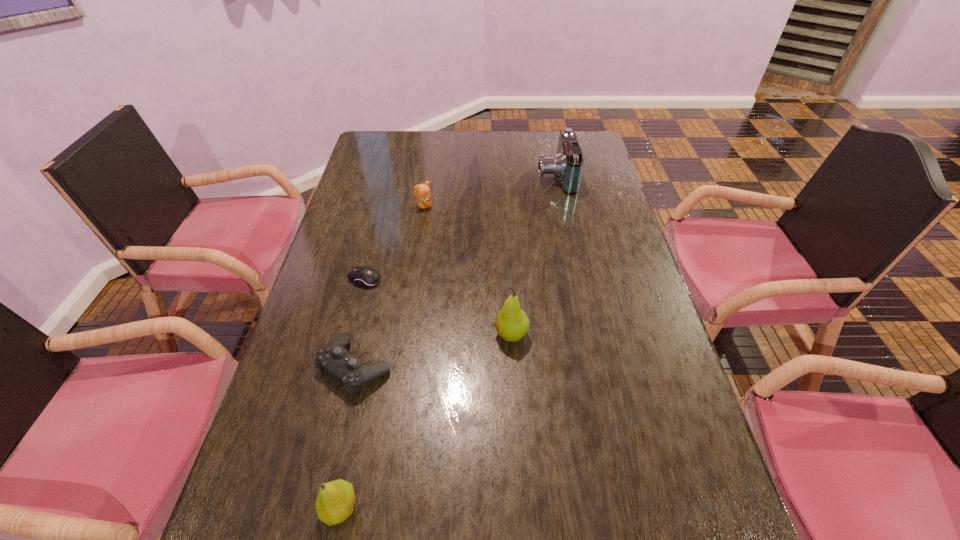
Where is `free spot between the fifth tallest object and the nearer pear`? The height and width of the screenshot is (540, 960). free spot between the fifth tallest object and the nearer pear is located at coordinates (348, 438).

Locate an element on the screen. free space between the left pear and the fifth nearest object is located at coordinates (382, 357).

Locate an element on the screen. free spot between the shortest object and the control is located at coordinates (360, 323).

This screenshot has width=960, height=540. Find the location of `free spot between the shorter pear and the tallest object`. free spot between the shorter pear and the tallest object is located at coordinates (425, 421).

Image resolution: width=960 pixels, height=540 pixels. Identify the location of object that ranks as the second closest to the fifth nearest object. (567, 165).

Where is `object that stands as the third closest to the control`? The image size is (960, 540). object that stands as the third closest to the control is located at coordinates (512, 323).

Find the location of a particular element. vacant position in the image that satisfies the following two spatial constraints: 1. on the face of the right pear; 2. on the right side of the teddy bear is located at coordinates (405, 334).